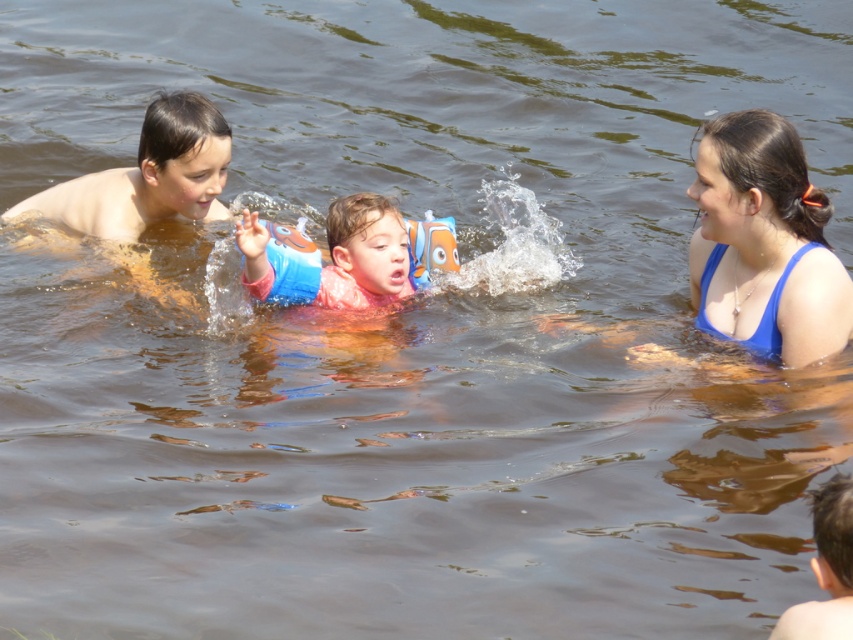
Looking at this image, you are standing on the dock and see the point at coordinates (146, 188). What is the color of the object at that point?

The point at coordinates (146, 188) is on light brown skin at left.

You are a photographer standing on the shore of the lake. You want to take a photo that includes both the blue fabric at right and the light brown skin at left. Which object should you position closer to the camera to ensure both are in focus?

To ensure both the blue fabric at right and the light brown skin at left are in focus, position the blue fabric at right closer to the camera since it is in front of the light brown skin at left.

You are a photographer trying to capture a clear shot of both the blue fabric at right and the blue rubber arm band at center. Since you want both objects in focus, which one should you adjust your camera focus to prioritize first?

You should prioritize focusing on the blue fabric at right first because it is closer to the viewer than the blue rubber arm band at center, ensuring both can be in focus by adjusting the depth of field accordingly.